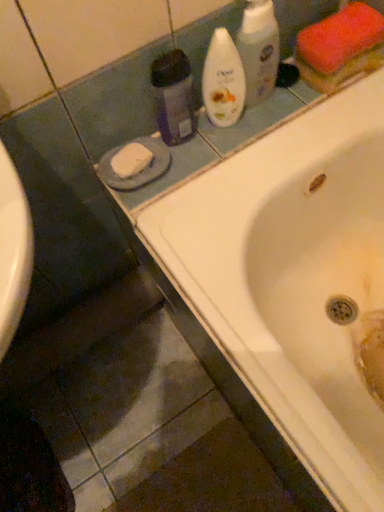
This screenshot has height=512, width=384. I want to click on vacant space in front of translucent purple bottle at upper center, acting as the third cleaning product starting from the right, so click(x=173, y=179).